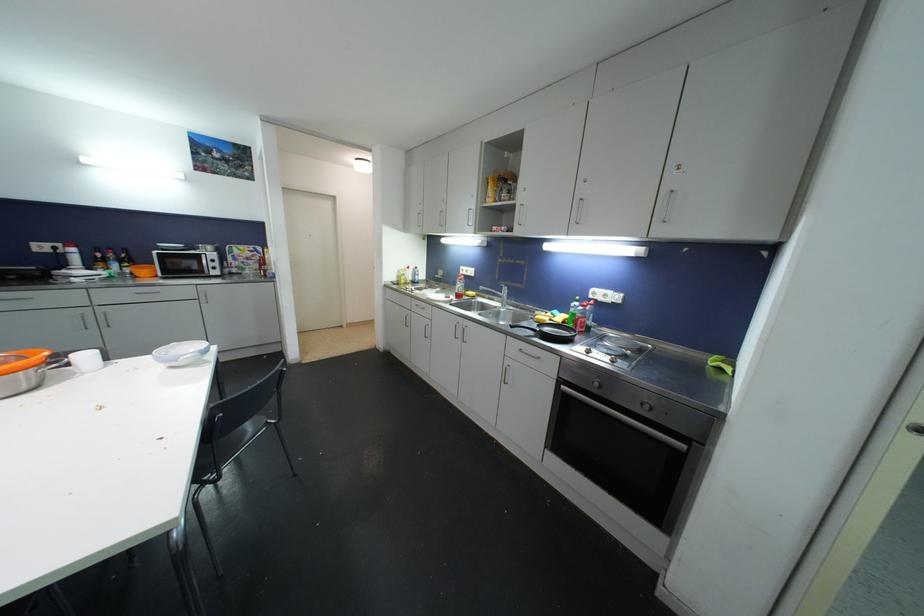
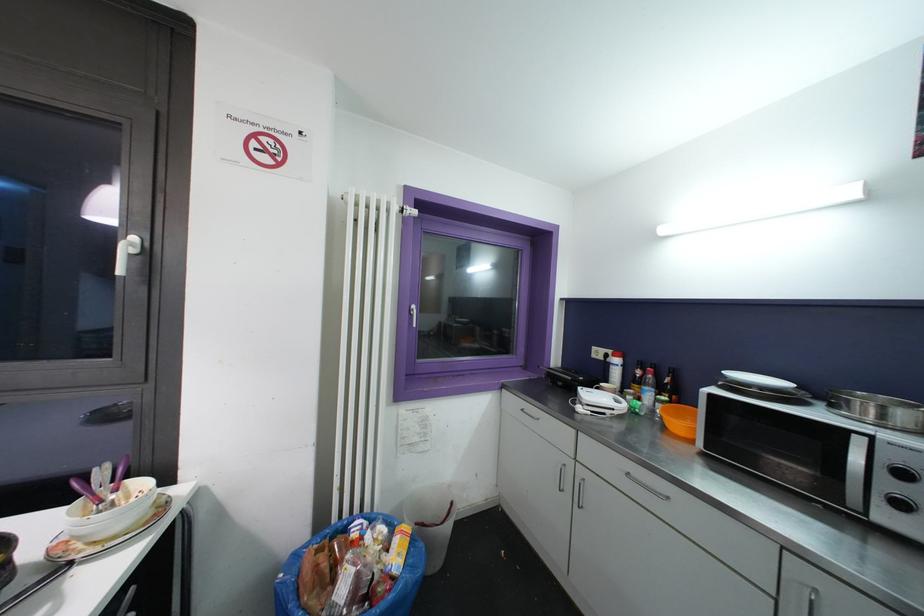
Locate, in the second image, the point that corresponds to point (124, 264) in the first image.

(663, 392)